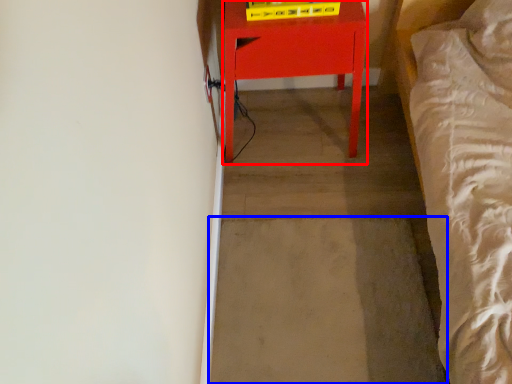
Question: Which of the following is the farthest to the observer, furniture (highlighted by a red box) or concrete (highlighted by a blue box)?

Choices:
 (A) furniture
 (B) concrete

Answer: (B)